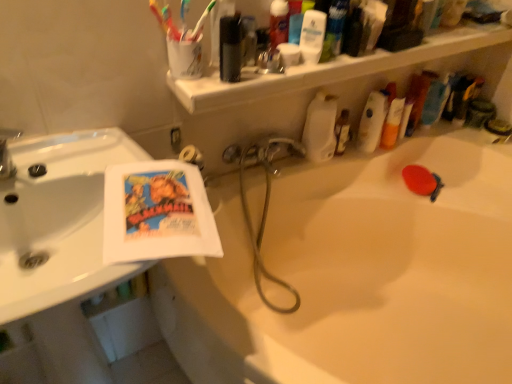
Find the location of a particular element. The height and width of the screenshot is (384, 512). white plastic shelf at upper center is located at coordinates (330, 70).

In order to face white plastic shelf at upper center, should I rotate leftwards or rightwards?

To align with it, rotate right about 15.633°.

What are the coordinates of `white plastic toothbrush at upper center, the first toothbrush positioned from the right` in the screenshot? It's located at (202, 19).

This screenshot has width=512, height=384. Describe the element at coordinates (170, 24) in the screenshot. I see `translucent plastic toothbrush at upper left, the first toothbrush in the left-to-right sequence` at that location.

This screenshot has height=384, width=512. Describe the element at coordinates (320, 128) in the screenshot. I see `white matte bottle at upper center, which is counted as the 1th cleaning product, starting from the left` at that location.

The image size is (512, 384). What do you see at coordinates (60, 220) in the screenshot? I see `white glossy sink at upper left` at bounding box center [60, 220].

You are a GUI agent. You are given a task and a screenshot of the screen. Output one action in this format:
    pyautogui.click(x=<x>, y=<y>)
    Task: Click on the metallic silver mouthwash at upper center, arranged as the second mouthwash when viewed from the right
    This screenshot has height=384, width=512.
    Given the screenshot: What is the action you would take?
    pyautogui.click(x=230, y=48)

Between metallic silver soap dispenser at upper right, the 1th toiletry from the right, and white glossy sink at upper left, which one has larger width?

With larger width is white glossy sink at upper left.

Looking at this image, which is more to the left, metallic silver soap dispenser at upper right, which is counted as the 2th toiletry, starting from the left, or white glossy sink at upper left?

Positioned to the left is white glossy sink at upper left.

Which is further, [461,102] or [84,280]?

The point [461,102] is behind.

Who is taller, white glossy bathtub at center or metallic silver soap dispenser at upper right, which is counted as the 2th toiletry, starting from the left?

Standing taller between the two is white glossy bathtub at center.

Which object is thinner, white glossy bathtub at center or metallic silver soap dispenser at upper right, which is counted as the 2th toiletry, starting from the left?

With smaller width is metallic silver soap dispenser at upper right, which is counted as the 2th toiletry, starting from the left.

Considering the sizes of white glossy bathtub at center and metallic silver soap dispenser at upper right, which is counted as the 2th toiletry, starting from the left, in the image, is white glossy bathtub at center bigger or smaller than metallic silver soap dispenser at upper right, which is counted as the 2th toiletry, starting from the left,?

Considering their sizes, white glossy bathtub at center takes up more space than metallic silver soap dispenser at upper right, which is counted as the 2th toiletry, starting from the left.

Between white glossy bathtub at center and metallic silver soap dispenser at upper right, the 1th toiletry from the right, which one appears on the left side from the viewer's perspective?

From the viewer's perspective, white glossy bathtub at center appears more on the left side.

From the image's perspective, is black rubber hose at center on blue plastic toothbrush at upper right, which is counted as the 1th toiletry, starting from the left?

No, from the image's perspective, black rubber hose at center is not above blue plastic toothbrush at upper right, which is counted as the 1th toiletry, starting from the left.

How distant is black rubber hose at center from blue plastic toothbrush at upper right, which is counted as the 1th toiletry, starting from the left?

A distance of 25.54 inches exists between black rubber hose at center and blue plastic toothbrush at upper right, which is counted as the 1th toiletry, starting from the left.

Between black rubber hose at center and blue plastic toothbrush at upper right, which is counted as the 1th toiletry, starting from the left, which one has less height?

With less height is black rubber hose at center.

From a real-world perspective, is black rubber hose at center under blue plastic toothbrush at upper right, the 2th toiletry in the right-to-left sequence?

Yes, from a real-world perspective, black rubber hose at center is below blue plastic toothbrush at upper right, the 2th toiletry in the right-to-left sequence.

Looking at their sizes, would you say white glossy sink at upper left is wider or thinner than blue plastic toothbrush at upper right, which is counted as the 1th toiletry, starting from the left?

In the image, white glossy sink at upper left appears to be wider than blue plastic toothbrush at upper right, which is counted as the 1th toiletry, starting from the left.

Is white glossy sink at upper left in front of blue plastic toothbrush at upper right, the 2th toiletry in the right-to-left sequence?

Yes, white glossy sink at upper left is closer to the camera.

At what (x,y) coordinates should I click in order to perform the action: click on the 1st toiletry behind the white glossy sink at upper left, starting your count from the anchor. Please return your answer as a coordinate pair (x, y). Looking at the image, I should click on (435, 100).

Does white glossy sink at upper left appear on the left side of blue plastic toothbrush at upper right, the 2th toiletry in the right-to-left sequence?

Indeed, white glossy sink at upper left is positioned on the left side of blue plastic toothbrush at upper right, the 2th toiletry in the right-to-left sequence.

Who is bigger, blue plastic toothbrush at upper right, the 2th toiletry in the right-to-left sequence, or white glossy mouthwash at upper center, arranged as the second mouthwash when viewed from the left?

With larger size is blue plastic toothbrush at upper right, the 2th toiletry in the right-to-left sequence.

Is blue plastic toothbrush at upper right, which is counted as the 1th toiletry, starting from the left, closer to the viewer compared to white glossy mouthwash at upper center, which appears as the first mouthwash when viewed from the right?

No, it is behind white glossy mouthwash at upper center, which appears as the first mouthwash when viewed from the right.

From a real-world perspective, is blue plastic toothbrush at upper right, which is counted as the 1th toiletry, starting from the left, on white glossy mouthwash at upper center, which appears as the first mouthwash when viewed from the right?

No.

Considering the relative sizes of blue plastic toothbrush at upper right, which is counted as the 1th toiletry, starting from the left, and white glossy mouthwash at upper center, arranged as the second mouthwash when viewed from the left, in the image provided, is blue plastic toothbrush at upper right, which is counted as the 1th toiletry, starting from the left, thinner than white glossy mouthwash at upper center, arranged as the second mouthwash when viewed from the left,?

No.

Can you tell me how much white plastic toothbrush at upper center, the first toothbrush positioned from the right, and translucent plastic bottle at upper right, positioned as the 1th cleaning product in right-to-left order, differ in facing direction?

0.000348 degrees.

From the image's perspective, is white plastic toothbrush at upper center, the first toothbrush positioned from the right, under translucent plastic bottle at upper right, placed as the second cleaning product when sorted from left to right?

Actually, white plastic toothbrush at upper center, the first toothbrush positioned from the right, appears above translucent plastic bottle at upper right, placed as the second cleaning product when sorted from left to right, in the image.

Does point (211, 9) come in front of point (381, 116)?

Yes.

Is metallic silver soap dispenser at upper right, which is counted as the 2th toiletry, starting from the left, not inside white matte bottle at upper center, which is counted as the 1th cleaning product, starting from the left?

Yes, metallic silver soap dispenser at upper right, which is counted as the 2th toiletry, starting from the left, is located beyond the bounds of white matte bottle at upper center, which is counted as the 1th cleaning product, starting from the left.

Is metallic silver soap dispenser at upper right, which is counted as the 2th toiletry, starting from the left, closer to camera compared to white matte bottle at upper center, which is counted as the 1th cleaning product, starting from the left?

No, the depth of metallic silver soap dispenser at upper right, which is counted as the 2th toiletry, starting from the left, is greater than that of white matte bottle at upper center, which is counted as the 1th cleaning product, starting from the left.

Is metallic silver soap dispenser at upper right, the 1th toiletry from the right, far from white matte bottle at upper center, the 2th cleaning product from the right?

metallic silver soap dispenser at upper right, the 1th toiletry from the right, is actually quite close to white matte bottle at upper center, the 2th cleaning product from the right.

Considering the points (465, 85) and (322, 158), which point is in front, point (465, 85) or point (322, 158)?

Point (322, 158)

Starting from the white glossy sink at upper left, which toiletry is the 2nd one to the right? Please provide its 2D coordinates.

[(466, 97)]

Identify the location of bathtub lying in front of the metallic silver soap dispenser at upper right, which is counted as the 2th toiletry, starting from the left. This screenshot has height=384, width=512. (357, 274).

Consider the image. Which object lies nearer to the anchor point white plastic toothbrush at upper center, the second toothbrush viewed from the left, white glossy mouthwash at upper center, arranged as the second mouthwash when viewed from the left, or blue plastic toothbrush at upper right, which is counted as the 1th toiletry, starting from the left?

Among the two, white glossy mouthwash at upper center, arranged as the second mouthwash when viewed from the left, is located nearer to white plastic toothbrush at upper center, the second toothbrush viewed from the left.

When comparing their distances from metallic silver mouthwash at upper center, arranged as the second mouthwash when viewed from the right, does white glossy mouthwash at upper center, which appears as the first mouthwash when viewed from the right, or translucent plastic toothbrush at upper left, the 2th toothbrush when ordered from right to left, seem further?

white glossy mouthwash at upper center, which appears as the first mouthwash when viewed from the right, lies further to metallic silver mouthwash at upper center, arranged as the second mouthwash when viewed from the right, than the other object.

Looking at the image, which one is located closer to translucent plastic toothbrush at upper left, the first toothbrush in the left-to-right sequence, translucent plastic bottle at upper right, positioned as the 1th cleaning product in right-to-left order, or white plastic shelf at upper center?

The object closer to translucent plastic toothbrush at upper left, the first toothbrush in the left-to-right sequence, is white plastic shelf at upper center.

Estimate the real-world distances between objects in this image. Which object is closer to black rubber hose at center, white matte bottle at upper center, the 2th cleaning product from the right, or white glossy bathtub at center?

white matte bottle at upper center, the 2th cleaning product from the right, is positioned closer to the anchor black rubber hose at center.

Based on their spatial positions, is black rubber hose at center or white glossy mouthwash at upper center, arranged as the second mouthwash when viewed from the left, further from white matte bottle at upper center, the 2th cleaning product from the right?

The object further to white matte bottle at upper center, the 2th cleaning product from the right, is white glossy mouthwash at upper center, arranged as the second mouthwash when viewed from the left.

Based on their spatial positions, is translucent plastic toothbrush at upper left, the 2th toothbrush when ordered from right to left, or white glossy bathtub at center closer to white glossy sink at upper left?

translucent plastic toothbrush at upper left, the 2th toothbrush when ordered from right to left.

Looking at the image, which one is located further to black rubber hose at center, metallic silver mouthwash at upper center, the first mouthwash in the left-to-right sequence, or blue plastic toothbrush at upper right, which is counted as the 1th toiletry, starting from the left?

Based on the image, blue plastic toothbrush at upper right, which is counted as the 1th toiletry, starting from the left, appears to be further to black rubber hose at center.

In the scene shown: Looking at the image, which one is located further to black rubber hose at center, white matte bottle at upper center, the 2th cleaning product from the right, or white plastic toothbrush at upper center, the second toothbrush viewed from the left?

Among the two, white plastic toothbrush at upper center, the second toothbrush viewed from the left, is located further to black rubber hose at center.

Where is `toothbrush between translucent plastic toothbrush at upper left, the first toothbrush in the left-to-right sequence, and metallic silver mouthwash at upper center, arranged as the second mouthwash when viewed from the right, in the horizontal direction`? This screenshot has height=384, width=512. toothbrush between translucent plastic toothbrush at upper left, the first toothbrush in the left-to-right sequence, and metallic silver mouthwash at upper center, arranged as the second mouthwash when viewed from the right, in the horizontal direction is located at coordinates (202, 19).

Where is `toothbrush located between translucent plastic toothbrush at upper left, the 2th toothbrush when ordered from right to left, and black rubber hose at center in the depth direction`? The height and width of the screenshot is (384, 512). toothbrush located between translucent plastic toothbrush at upper left, the 2th toothbrush when ordered from right to left, and black rubber hose at center in the depth direction is located at coordinates point(202,19).

Where is `toiletry between black rubber hose at center and metallic silver soap dispenser at upper right, which is counted as the 2th toiletry, starting from the left, from left to right`? The width and height of the screenshot is (512, 384). toiletry between black rubber hose at center and metallic silver soap dispenser at upper right, which is counted as the 2th toiletry, starting from the left, from left to right is located at coordinates (435, 100).

Where is `plumbing fixture located between white plastic toothbrush at upper center, the first toothbrush positioned from the right, and white plastic shelf at upper center in the left-right direction`? Image resolution: width=512 pixels, height=384 pixels. plumbing fixture located between white plastic toothbrush at upper center, the first toothbrush positioned from the right, and white plastic shelf at upper center in the left-right direction is located at coordinates (262, 152).